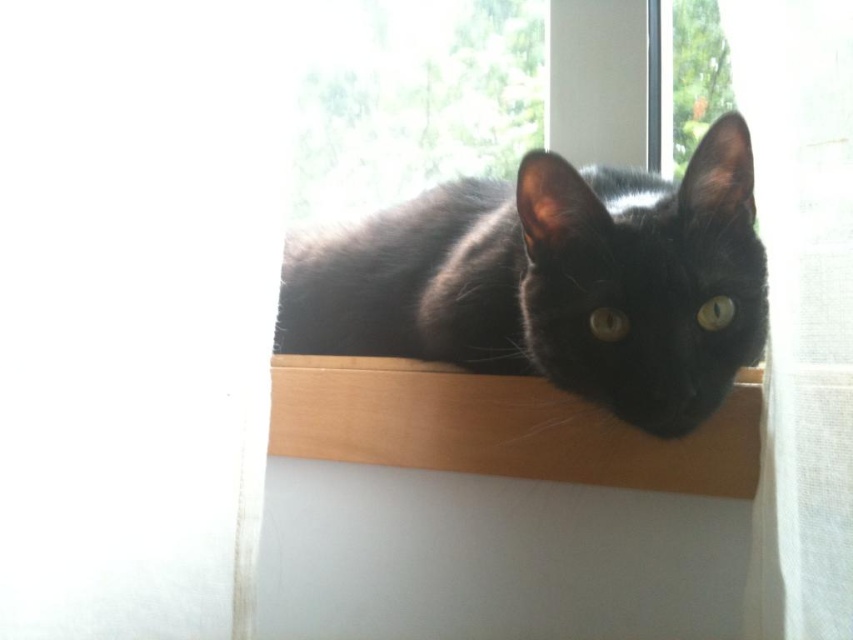
You are a photographer aiming to capture the black fur cat at center. The camera is positioned at point 0.5, 0.5. Can you determine if the cat is within the camera frame?

The black fur cat at center is located at point (555, 282), which is close to the camera position at (426, 320). Since the coordinates are within a typical camera frame, the cat is likely within the frame.

You are a small toy mouse that is 2 inches long. You are placed on the wooden shelf at center and want to reach the black fur cat at center. Can you roll yourself over to the cat without falling off the shelf?

The black fur cat at center and wooden shelf at center are 5.05 inches apart. Since the toy mouse is 2 inches long, it can roll over the distance between them without falling off the shelf as the distance is greater than its length.

You are a photographer aiming to capture the black fur cat at center and the wooden shelf at center in a single shot. Given that your camera can only focus on objects wider than 20 cm, will both objects be in focus?

The black fur cat at center is wider than the wooden shelf at center. Since the cat is wider than 20 cm, both objects will be in focus as they are wider than the camera requirement.